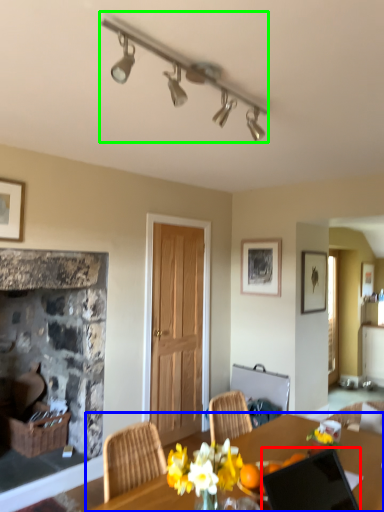
Question: Considering the real-world distances, which object is farthest from laptop (highlighted by a red box)? desk (highlighted by a blue box) or lamp (highlighted by a green box)?

Choices:
 (A) desk
 (B) lamp

Answer: (B)